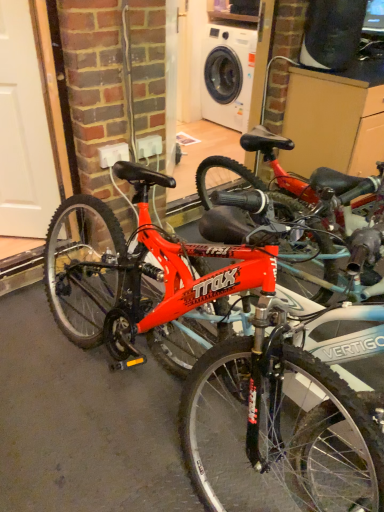
Question: Should I look upward or downward to see white glossy garage door at left?

Choices:
 (A) up
 (B) down

Answer: (A)

Question: Does shiny red bicycle at center have a lesser width compared to white glossy garage door at left?

Choices:
 (A) no
 (B) yes

Answer: (A)

Question: Can you confirm if shiny red bicycle at center is taller than white glossy garage door at left?

Choices:
 (A) yes
 (B) no

Answer: (B)

Question: Would you consider shiny red bicycle at center to be distant from white glossy garage door at left?

Choices:
 (A) yes
 (B) no

Answer: (B)

Question: Is shiny red bicycle at center oriented towards white glossy garage door at left?

Choices:
 (A) yes
 (B) no

Answer: (B)

Question: Does shiny red bicycle at center have a greater width compared to white glossy garage door at left?

Choices:
 (A) no
 (B) yes

Answer: (B)

Question: From a real-world perspective, is shiny red bicycle at center located higher than white glossy garage door at left?

Choices:
 (A) no
 (B) yes

Answer: (A)

Question: Can you confirm if white glossy garage door at left is taller than shiny red bicycle at center?

Choices:
 (A) no
 (B) yes

Answer: (B)

Question: From the image's perspective, would you say white glossy garage door at left is shown under shiny red bicycle at center?

Choices:
 (A) no
 (B) yes

Answer: (A)

Question: Is white glossy garage door at left thinner than shiny red bicycle at center?

Choices:
 (A) yes
 (B) no

Answer: (A)

Question: Does white glossy garage door at left have a greater width compared to shiny red bicycle at center?

Choices:
 (A) yes
 (B) no

Answer: (B)

Question: Does white glossy garage door at left appear on the left side of shiny red bicycle at center?

Choices:
 (A) no
 (B) yes

Answer: (B)

Question: From a real-world perspective, is white glossy garage door at left positioned over shiny red bicycle at center based on gravity?

Choices:
 (A) yes
 (B) no

Answer: (A)

Question: From the image's perspective, is shiny red bicycle at center located above or below white glossy garage door at left?

Choices:
 (A) below
 (B) above

Answer: (A)